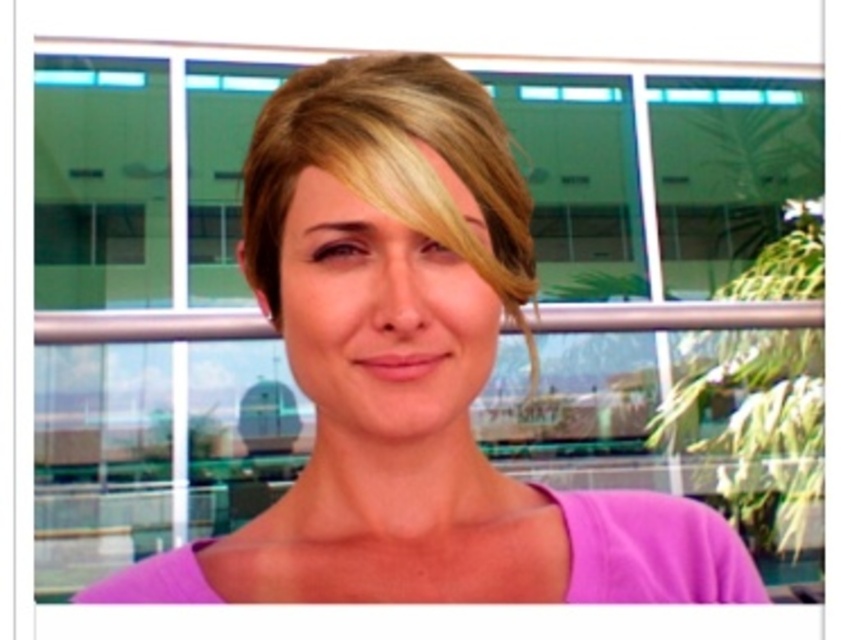
You are a photographer adjusting the camera focus. You need to ensure both the purple matte shirt at center and the blonde shiny hair at center are in focus. Given that the depth of field can only sharply focus on one object at a time, which object should you prioritize focusing on to ensure the one that is taller is in focus?

The purple matte shirt at center is taller than the blonde shiny hair at center, so you should prioritize focusing on the purple matte shirt at center to ensure the taller object is in focus.

You are a fashion designer analyzing the image. The purple matte shirt at center is part of a new collection. Based on the scene, where would you place this shirt in a catalog layout if you want to highlight its visibility? Explain your reasoning using the shirt and the scene details.

The purple matte shirt at center is located at point (x=413, y=372), which is near the center of the image. To highlight its visibility in a catalog layout, place it in the central position since the shirt is already positioned at the center in the original image, making it the focal point. The bright natural lighting and the contrasting background of the modern building and greenery ensure the shirt stands out effectively.

You are a photographer adjusting the camera focus. You need to ensure both the purple matte shirt at center and the blonde shiny hair at center are in focus. Given their sizes, which object should you prioritize focusing on first?

The purple matte shirt at center is larger in size than the blonde shiny hair at center, so you should prioritize focusing on the purple matte shirt at center first to ensure both are in focus.